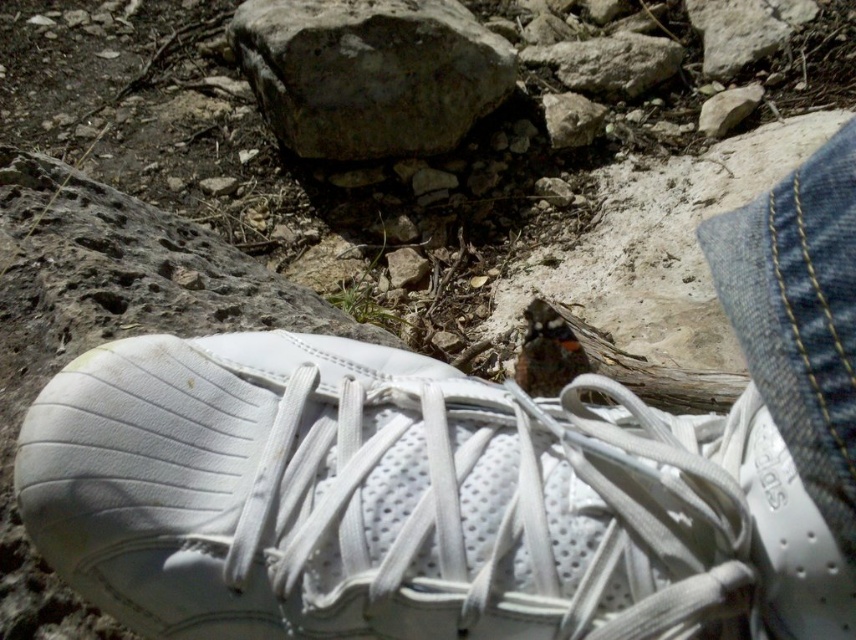
Can you confirm if white leather shoe at center is positioned above gray rough rock at upper right?

No.

Who is more distant from viewer, (x=557, y=620) or (x=709, y=106)?

The point (x=709, y=106) is behind.

The image size is (856, 640). Find the location of `white leather shoe at center`. white leather shoe at center is located at coordinates (372, 497).

Describe the element at coordinates (372, 497) in the screenshot. The image size is (856, 640). I see `white leather shoe at center` at that location.

Which is behind, point (538, 598) or point (259, 0)?

Positioned behind is point (259, 0).

The width and height of the screenshot is (856, 640). Find the location of `white leather shoe at center`. white leather shoe at center is located at coordinates (372, 497).

Can you confirm if gray rough rock at center is bigger than smooth gray rock at center?

Correct, gray rough rock at center is larger in size than smooth gray rock at center.

Which is more to the left, gray rough rock at center or smooth gray rock at center?

Positioned to the left is gray rough rock at center.

Which is in front, point (384, 0) or point (578, 134)?

Point (384, 0)

Find the location of `gray rough rock at center`. gray rough rock at center is located at coordinates (369, 74).